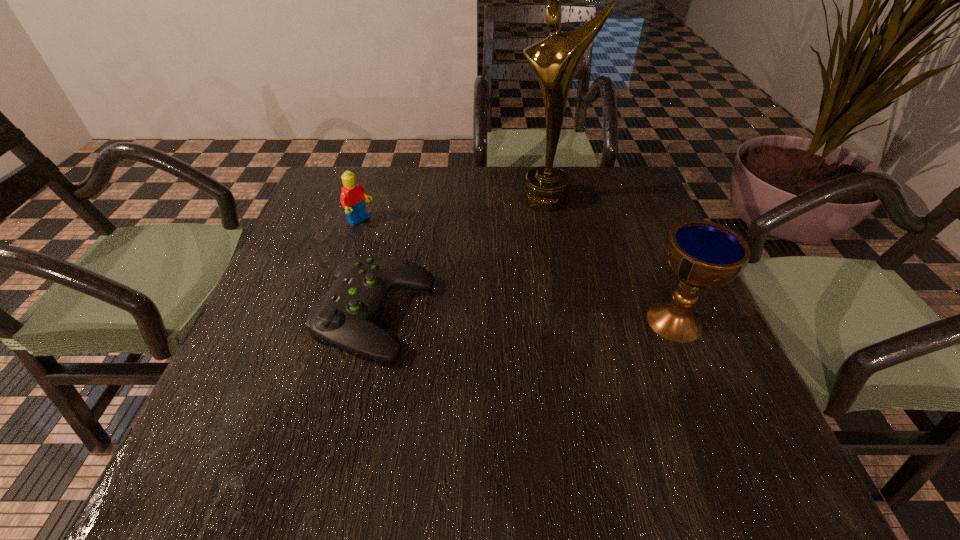
Locate an element on the screen. vacant space located on the face of the Lego is located at coordinates (402, 247).

Where is `free space located 0.310m on the face of the Lego`? The height and width of the screenshot is (540, 960). free space located 0.310m on the face of the Lego is located at coordinates (461, 283).

This screenshot has height=540, width=960. I want to click on free space located 0.200m on the front-facing side of the tallest object, so click(517, 259).

You are a GUI agent. You are given a task and a screenshot of the screen. Output one action in this format:
    pyautogui.click(x=<x>, y=<y>)
    Task: Click on the free space located on the front-facing side of the tallest object
    The height and width of the screenshot is (540, 960).
    Given the screenshot: What is the action you would take?
    [513, 270]

Find the location of a particular element. free space located 0.230m on the front-facing side of the tallest object is located at coordinates (514, 267).

Locate an element on the screen. The height and width of the screenshot is (540, 960). Lego that is at the far edge is located at coordinates (352, 198).

This screenshot has height=540, width=960. Identify the location of award present at the far edge. (554, 60).

Image resolution: width=960 pixels, height=540 pixels. Find the location of `control that is at the left edge`. control that is at the left edge is located at coordinates (343, 316).

Find the location of a particular element. This screenshot has width=960, height=540. Lego present at the left edge is located at coordinates (352, 198).

Where is `object positioned at the right edge`? object positioned at the right edge is located at coordinates (703, 254).